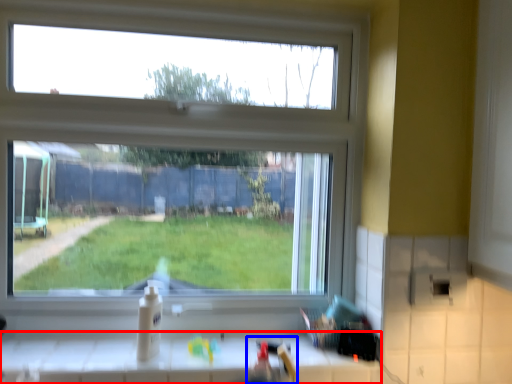
Question: Which point is further to the camera, counter (highlighted by a red box) or sink (highlighted by a blue box)?

Choices:
 (A) counter
 (B) sink

Answer: (A)